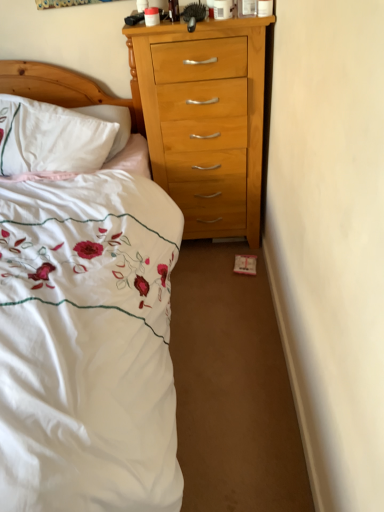
Where is `white embroidered bed at left`? Image resolution: width=384 pixels, height=512 pixels. white embroidered bed at left is located at coordinates (87, 345).

Describe the element at coordinates (87, 345) in the screenshot. I see `white embroidered bed at left` at that location.

In order to face white embroidered bed at left, should I rotate leftwards or rightwards?

To align with it, rotate left about 22.606°.

Describe the element at coordinates (50, 138) in the screenshot. This screenshot has height=512, width=384. I see `white soft pillow at left` at that location.

What is the approximate width of white soft pillow at left?

It is 19.13 centimeters.

Where is `white soft pillow at left`? This screenshot has height=512, width=384. white soft pillow at left is located at coordinates (50, 138).

The width and height of the screenshot is (384, 512). Identify the location of white embroidered bed at left. (87, 345).

Between white soft pillow at left and white embroidered bed at left, which one appears on the left side from the viewer's perspective?

Positioned to the left is white soft pillow at left.

Relative to white embroidered bed at left, is white soft pillow at left in front or behind?

In the image, white soft pillow at left appears behind white embroidered bed at left.

Is point (74, 129) closer or farther from the camera than point (142, 466)?

Point (74, 129) is positioned farther from the camera compared to point (142, 466).

From the image's perspective, which one is positioned higher, white soft pillow at left or white embroidered bed at left?

white soft pillow at left.

From a real-world perspective, is white soft pillow at left under white embroidered bed at left?

Actually, white soft pillow at left is physically above white embroidered bed at left in the real world.

Considering the sizes of objects white soft pillow at left and white embroidered bed at left in the image provided, who is wider, white soft pillow at left or white embroidered bed at left?

white embroidered bed at left is wider.

From the picture: In terms of height, does white soft pillow at left look taller or shorter compared to white embroidered bed at left?

white soft pillow at left is shorter than white embroidered bed at left.

Considering the sizes of objects white soft pillow at left and white embroidered bed at left in the image provided, who is bigger, white soft pillow at left or white embroidered bed at left?

white embroidered bed at left.

From the picture: Is white soft pillow at left surrounding white embroidered bed at left?

No, white embroidered bed at left is located outside of white soft pillow at left.

Does white soft pillow at left touch white embroidered bed at left?

white soft pillow at left is not next to white embroidered bed at left, and they're not touching.

Is white soft pillow at left looking in the opposite direction of white embroidered bed at left?

Yes.

What's the angular difference between white soft pillow at left and white embroidered bed at left's facing directions?

The angular difference between white soft pillow at left and white embroidered bed at left is 21.5 degrees.

Where is `bed below the white soft pillow at left (from the image's perspective)`? bed below the white soft pillow at left (from the image's perspective) is located at coordinates (87, 345).

Which object is positioned more to the right, white embroidered bed at left or white soft pillow at left?

From the viewer's perspective, white embroidered bed at left appears more on the right side.

Is white embroidered bed at left positioned behind white soft pillow at left?

No, the depth of white embroidered bed at left is less than that of white soft pillow at left.

Considering the points (145, 330) and (55, 120), which point is behind, point (145, 330) or point (55, 120)?

The point (55, 120) is farther.

From the image's perspective, is white embroidered bed at left located beneath white soft pillow at left?

Indeed, from the image's perspective, white embroidered bed at left is shown beneath white soft pillow at left.

From a real-world perspective, is white embroidered bed at left below white soft pillow at left?

Yes, from a real-world perspective, white embroidered bed at left is beneath white soft pillow at left.

Can you confirm if white embroidered bed at left is wider than white soft pillow at left?

Yes.

Between white embroidered bed at left and white soft pillow at left, which one has more height?

white embroidered bed at left.

Between white embroidered bed at left and white soft pillow at left, which one has smaller size?

Smaller between the two is white soft pillow at left.

Is white embroidered bed at left not within white soft pillow at left?

Yes, white embroidered bed at left is outside of white soft pillow at left.

Is white embroidered bed at left next to white soft pillow at left and touching it?

white embroidered bed at left and white soft pillow at left are not in contact.

Is white embroidered bed at left positioned with its back to white soft pillow at left?

Yes, white soft pillow at left is at the back of white embroidered bed at left.

Where is `bed on the right of the white soft pillow at left`? The width and height of the screenshot is (384, 512). bed on the right of the white soft pillow at left is located at coordinates (87, 345).

The width and height of the screenshot is (384, 512). Find the location of `bed below the white soft pillow at left (from the image's perspective)`. bed below the white soft pillow at left (from the image's perspective) is located at coordinates (87, 345).

Locate an element on the screen. bed in front of the white soft pillow at left is located at coordinates (87, 345).